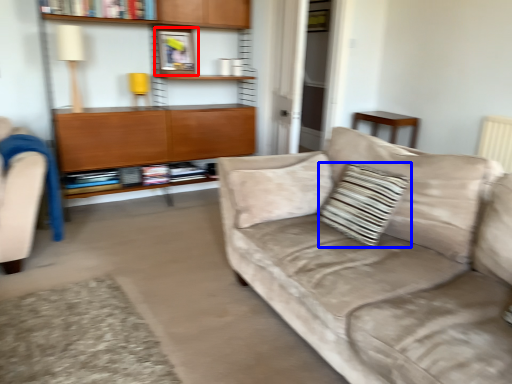
Question: Which of the following is the closest to the observer, picture frame (highlighted by a red box) or throw pillow (highlighted by a blue box)?

Choices:
 (A) picture frame
 (B) throw pillow

Answer: (B)